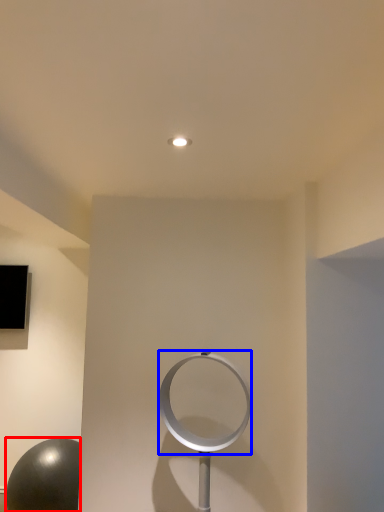
Question: Which object is closer to the camera taking this photo, ball (highlighted by a red box) or circle (highlighted by a blue box)?

Choices:
 (A) ball
 (B) circle

Answer: (B)